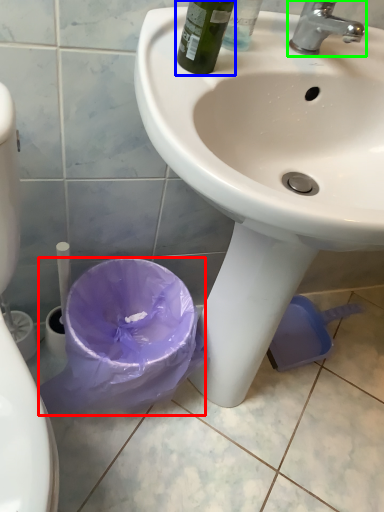
Question: Which object is the closest to the garbage (highlighted by a red box)? Choose among these: bottle (highlighted by a blue box) or tap (highlighted by a green box).

Choices:
 (A) bottle
 (B) tap

Answer: (A)